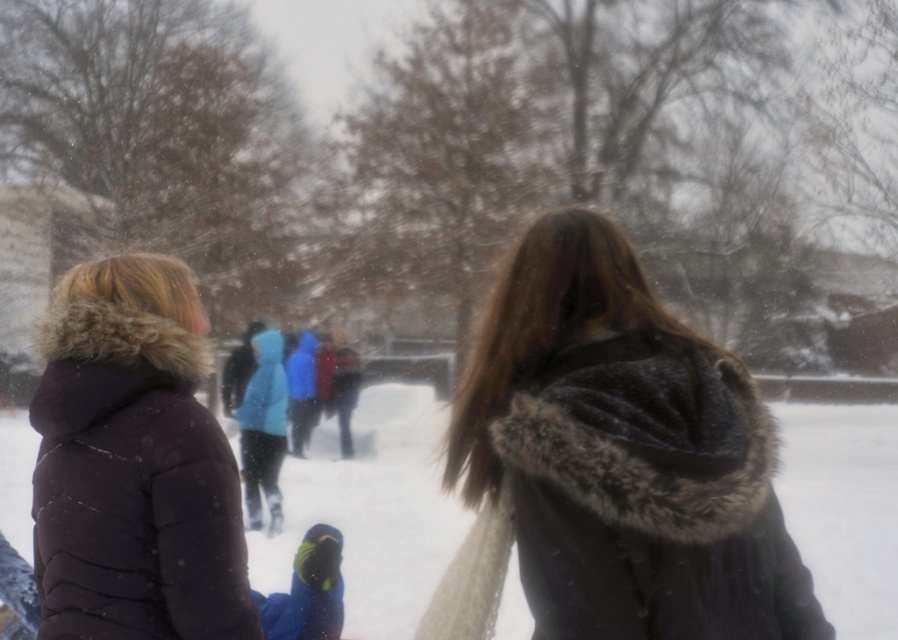
Which is more to the right, velvet-like dark coat at center or white fluffy snow at center?

Positioned to the right is white fluffy snow at center.

Can you confirm if velvet-like dark coat at center is wider than white fluffy snow at center?

No.

Which is behind, point (507, 433) or point (885, 454)?

The point (885, 454) is behind.

You are a GUI agent. You are given a task and a screenshot of the screen. Output one action in this format:
    pyautogui.click(x=<x>, y=<y>)
    Task: Click on the velvet-like dark coat at center
    The height and width of the screenshot is (640, 898).
    Given the screenshot: What is the action you would take?
    pyautogui.click(x=612, y=461)